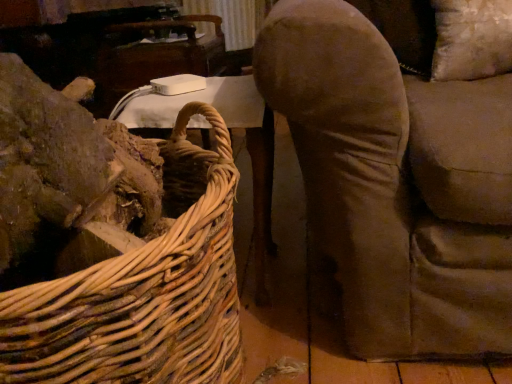
At what (x,y) coordinates should I click in order to perform the action: click on white plastic table at upper left, arranged as the 2th table when viewed from the top. Please return your answer as a coordinate pair (x, y). The width and height of the screenshot is (512, 384). Looking at the image, I should click on (229, 131).

Describe the element at coordinates (143, 291) in the screenshot. I see `woven natural wood picnic basket at left` at that location.

I want to click on white plastic table at upper center, which appears as the 1th table when viewed from the top, so click(x=155, y=57).

Is white plastic table at upper left, positioned as the 1th table in front-to-back order, completely or partially outside of woven natural wood picnic basket at left?

Indeed, white plastic table at upper left, positioned as the 1th table in front-to-back order, is completely outside woven natural wood picnic basket at left.

Which point is more distant from viewer, [212,98] or [184,355]?

Point [212,98]

Considering the relative sizes of white plastic table at upper left, which ranks as the second table in back-to-front order, and woven natural wood picnic basket at left in the image provided, is white plastic table at upper left, which ranks as the second table in back-to-front order, shorter than woven natural wood picnic basket at left?

Indeed, white plastic table at upper left, which ranks as the second table in back-to-front order, has a lesser height compared to woven natural wood picnic basket at left.

Considering the positions of objects white plastic table at upper left, which ranks as the second table in back-to-front order, and woven natural wood picnic basket at left in the image provided, who is more to the right, white plastic table at upper left, which ranks as the second table in back-to-front order, or woven natural wood picnic basket at left?

From the viewer's perspective, white plastic table at upper left, which ranks as the second table in back-to-front order, appears more on the right side.

Are white plastic table at upper center, marked as the second table in a front-to-back arrangement, and woven natural wood picnic basket at left making contact?

They are not placed beside each other.

Between point (180, 60) and point (209, 233), which one is positioned in front?

Positioned in front is point (209, 233).

From the image's perspective, between white plastic table at upper center, the 2th table from the bottom, and woven natural wood picnic basket at left, which one is located above?

white plastic table at upper center, the 2th table from the bottom, is shown above in the image.

Considering the sizes of white plastic table at upper center, the 2th table from the bottom, and woven natural wood picnic basket at left in the image, is white plastic table at upper center, the 2th table from the bottom, taller or shorter than woven natural wood picnic basket at left?

white plastic table at upper center, the 2th table from the bottom, is shorter than woven natural wood picnic basket at left.

Consider the image. Is white plastic table at upper left, the 1th table when ordered from bottom to top, thinner than white plastic table at upper center, positioned as the first table in back-to-front order?

Yes.

Looking at this image, measure the distance from white plastic table at upper left, arranged as the 2th table when viewed from the top, to white plastic table at upper center, which appears as the 1th table when viewed from the top.

white plastic table at upper left, arranged as the 2th table when viewed from the top, is 27.08 inches away from white plastic table at upper center, which appears as the 1th table when viewed from the top.

There is a white plastic table at upper left, the 1th table when ordered from bottom to top. In order to click on table above it (from a real-world perspective) in this screenshot , I will do `click(155, 57)`.

Is white plastic table at upper left, positioned as the 1th table in front-to-back order, facing towards white plastic table at upper center, marked as the second table in a front-to-back arrangement?

No, white plastic table at upper left, positioned as the 1th table in front-to-back order, is not oriented towards white plastic table at upper center, marked as the second table in a front-to-back arrangement.

From the picture: How different are the orientations of woven natural wood picnic basket at left and white plastic table at upper left, arranged as the 2th table when viewed from the top, in degrees?

They differ by 90 degrees in their facing directions.

Based on their positions, is woven natural wood picnic basket at left located to the left or right of white plastic table at upper left, which ranks as the second table in back-to-front order?

From the image, it's evident that woven natural wood picnic basket at left is to the left of white plastic table at upper left, which ranks as the second table in back-to-front order.

Which of these two, woven natural wood picnic basket at left or white plastic table at upper left, arranged as the 2th table when viewed from the top, is wider?

woven natural wood picnic basket at left is wider.

Is white plastic table at upper left, which ranks as the second table in back-to-front order, located within woven natural wood picnic basket at left?

That's incorrect, white plastic table at upper left, which ranks as the second table in back-to-front order, is not inside woven natural wood picnic basket at left.

Considering the positions of objects woven natural wood picnic basket at left and white plastic table at upper center, marked as the second table in a front-to-back arrangement, in the image provided, who is more to the right, woven natural wood picnic basket at left or white plastic table at upper center, marked as the second table in a front-to-back arrangement,?

Positioned to the right is woven natural wood picnic basket at left.

Is white plastic table at upper center, marked as the second table in a front-to-back arrangement, located within woven natural wood picnic basket at left?

No, white plastic table at upper center, marked as the second table in a front-to-back arrangement, is not inside woven natural wood picnic basket at left.

Which is behind, point (18, 359) or point (103, 54)?

Positioned behind is point (103, 54).

In the image, is woven natural wood picnic basket at left positioned in front of or behind white plastic table at upper center, marked as the second table in a front-to-back arrangement?

Clearly, woven natural wood picnic basket at left is in front of white plastic table at upper center, marked as the second table in a front-to-back arrangement.

Is white plastic table at upper center, the 2th table from the bottom, oriented towards white plastic table at upper left, positioned as the 1th table in front-to-back order?

No, white plastic table at upper center, the 2th table from the bottom, does not turn towards white plastic table at upper left, positioned as the 1th table in front-to-back order.

From a real-world perspective, is white plastic table at upper center, positioned as the first table in back-to-front order, above or below white plastic table at upper left, the 1th table when ordered from bottom to top?

white plastic table at upper center, positioned as the first table in back-to-front order, is above white plastic table at upper left, the 1th table when ordered from bottom to top.

Would you say white plastic table at upper center, positioned as the first table in back-to-front order, contains white plastic table at upper left, which ranks as the second table in back-to-front order?

No, white plastic table at upper left, which ranks as the second table in back-to-front order, is located outside of white plastic table at upper center, positioned as the first table in back-to-front order.

Considering the positions of point (106, 32) and point (220, 85), is point (106, 32) closer or farther from the camera than point (220, 85)?

Point (106, 32) is farther from the camera than point (220, 85).

The height and width of the screenshot is (384, 512). I want to click on table below the woven natural wood picnic basket at left (from a real-world perspective), so click(x=229, y=131).

At what (x,y) coordinates should I click in order to perform the action: click on table above the woven natural wood picnic basket at left (from a real-world perspective). Please return your answer as a coordinate pair (x, y). This screenshot has width=512, height=384. Looking at the image, I should click on (155, 57).

Based on the photo, looking at the image, which one is located closer to white plastic table at upper center, which appears as the 1th table when viewed from the top, white plastic table at upper left, positioned as the 1th table in front-to-back order, or woven natural wood picnic basket at left?

The object closer to white plastic table at upper center, which appears as the 1th table when viewed from the top, is white plastic table at upper left, positioned as the 1th table in front-to-back order.

Which object lies further to the anchor point woven natural wood picnic basket at left, white plastic table at upper center, marked as the second table in a front-to-back arrangement, or white plastic table at upper left, which ranks as the second table in back-to-front order?

white plastic table at upper center, marked as the second table in a front-to-back arrangement.

Looking at the image, which one is located further to white plastic table at upper center, marked as the second table in a front-to-back arrangement, woven natural wood picnic basket at left or white plastic table at upper left, which ranks as the second table in back-to-front order?

Among the two, woven natural wood picnic basket at left is located further to white plastic table at upper center, marked as the second table in a front-to-back arrangement.

Which object lies nearer to the anchor point white plastic table at upper left, arranged as the 2th table when viewed from the top, white plastic table at upper center, positioned as the first table in back-to-front order, or woven natural wood picnic basket at left?

Among the two, woven natural wood picnic basket at left is located nearer to white plastic table at upper left, arranged as the 2th table when viewed from the top.

When comparing their distances from white plastic table at upper left, arranged as the 2th table when viewed from the top, does woven natural wood picnic basket at left or white plastic table at upper center, positioned as the first table in back-to-front order, seem further?

Based on the image, white plastic table at upper center, positioned as the first table in back-to-front order, appears to be further to white plastic table at upper left, arranged as the 2th table when viewed from the top.

Based on their spatial positions, is white plastic table at upper left, arranged as the 2th table when viewed from the top, or white plastic table at upper center, positioned as the first table in back-to-front order, closer to woven natural wood picnic basket at left?

white plastic table at upper left, arranged as the 2th table when viewed from the top, lies closer to woven natural wood picnic basket at left than the other object.

The height and width of the screenshot is (384, 512). Find the location of `table between woven natural wood picnic basket at left and white plastic table at upper center, which appears as the 1th table when viewed from the top, from front to back`. table between woven natural wood picnic basket at left and white plastic table at upper center, which appears as the 1th table when viewed from the top, from front to back is located at coordinates (229, 131).